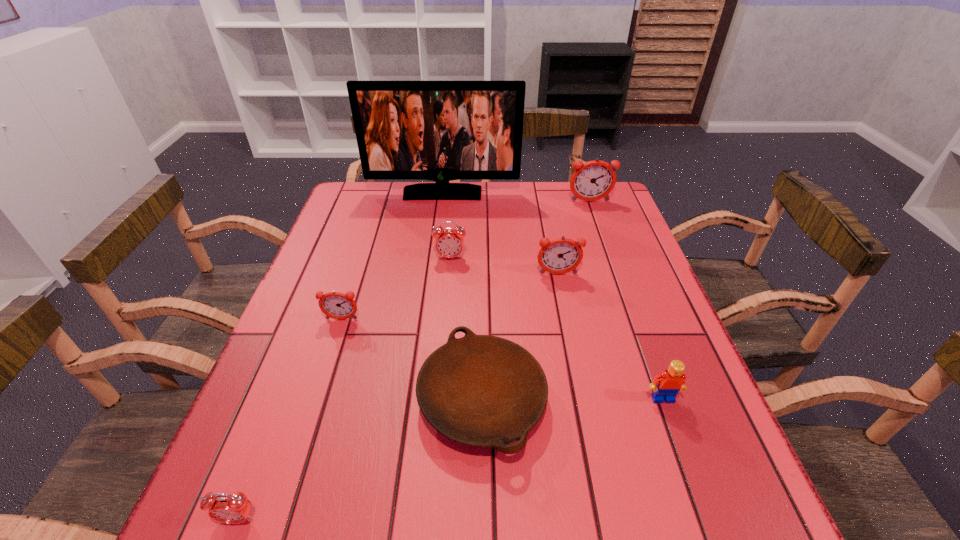
Locate an element on the screen. This screenshot has height=540, width=960. the nearest object is located at coordinates (231, 509).

Locate an element on the screen. the smaller red alarm clock is located at coordinates (231, 509).

What are the coordinates of `the shortest object` in the screenshot? It's located at (485, 391).

What are the coordinates of `plate` in the screenshot? It's located at (485, 391).

Find the location of a particular element. vacant region located on the front-facing side of the monitor is located at coordinates (433, 270).

The height and width of the screenshot is (540, 960). I want to click on free location located on the front-facing side of the farthest reddish-pink alarm clock, so (x=596, y=218).

Where is `vacant space located 0.340m on the front-facing side of the fourth alarm clock from left to right`? vacant space located 0.340m on the front-facing side of the fourth alarm clock from left to right is located at coordinates (581, 388).

In order to click on vacant space located 0.330m on the face of the farther red alarm clock in this screenshot , I will do `click(442, 359)`.

In order to click on vacant point located on the front-facing side of the Lego in this screenshot , I will do `click(683, 454)`.

At what (x,y) coordinates should I click in order to perform the action: click on vacant space positioned on the front-facing side of the leftmost reddish-pink alarm clock. Please return your answer as a coordinate pair (x, y). Looking at the image, I should click on (299, 454).